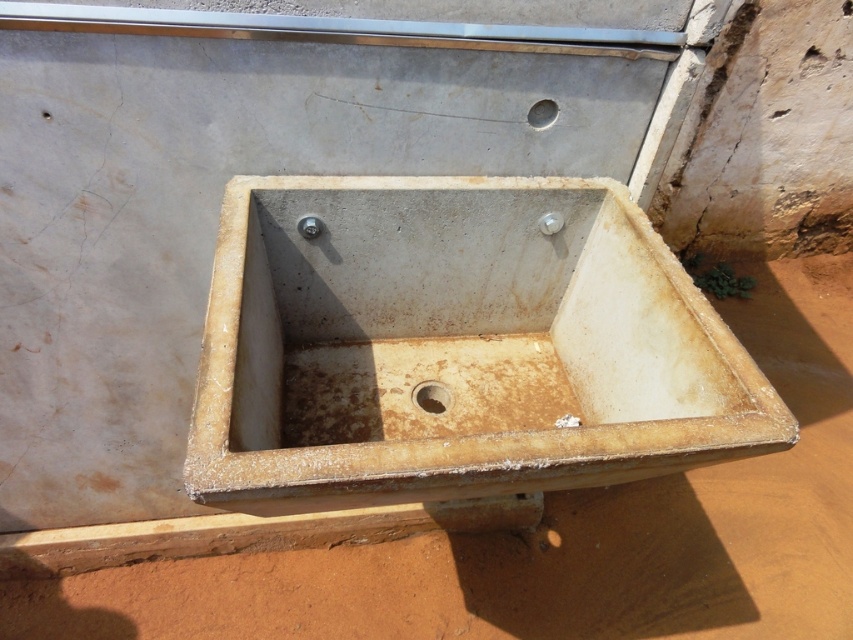
You are a maintenance worker checking the distance between the rusty concrete sink at center and the rusty metal drain at center. The safety regulation requires at least 15 inches between them. Is the current distance compliant with the regulation?

The rusty concrete sink at center is 14.96 inches away from the rusty metal drain at center, which is just 0.04 inches below the required 15 inches. Therefore, it does not comply with the safety regulation.